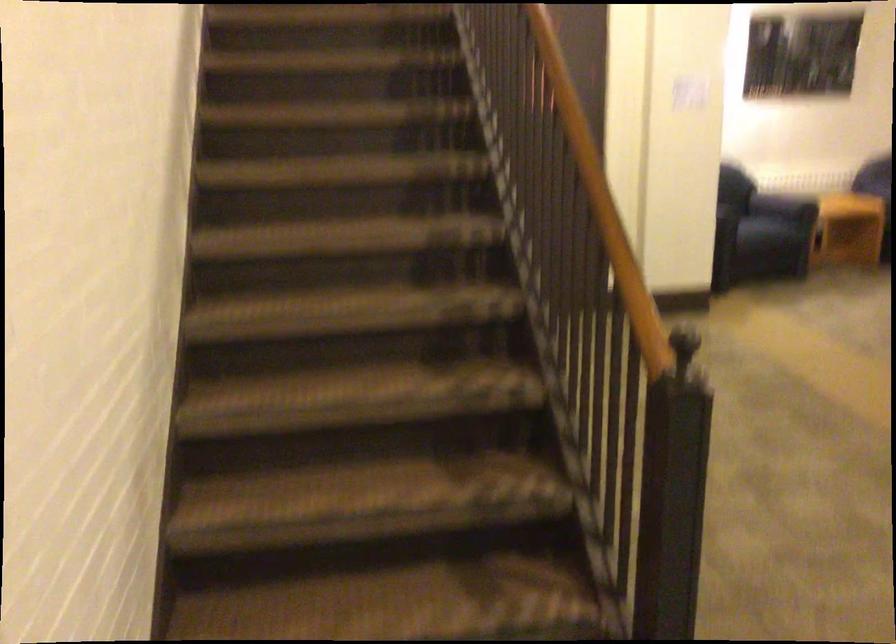
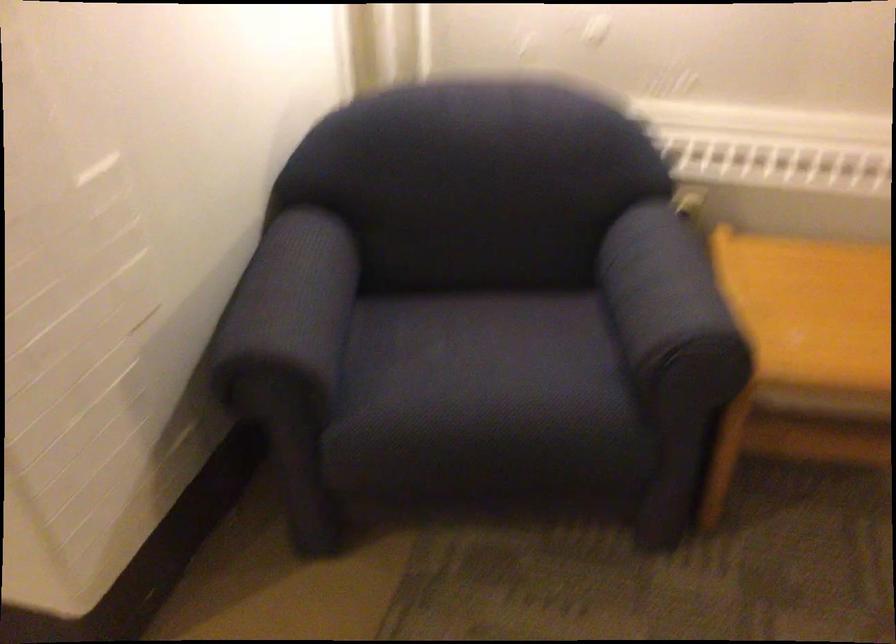
The point at (x=820, y=185) is marked in the first image. Where is the corresponding point in the second image?

(670, 307)